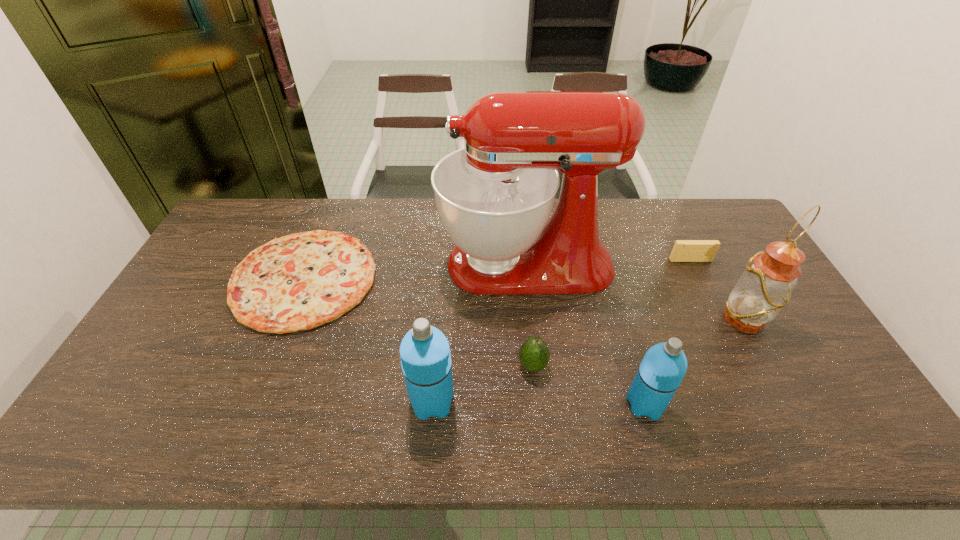
Identify the location of vacant space at the far left corner of the desktop. (240, 221).

In the image, there is a desktop. Where is `vacant area at the far right corner`? vacant area at the far right corner is located at coordinates (713, 201).

Identify the location of free space between the second tallest object and the videotape. The image size is (960, 540). (717, 290).

Where is `vacant space that's between the taller thermos bottle and the videotape`? vacant space that's between the taller thermos bottle and the videotape is located at coordinates (562, 331).

Identify the location of free spot between the pizza and the fifth shortest object. The image size is (960, 540). tap(368, 340).

What are the coordinates of `free space that is in between the left thermos bottle and the second shortest object` in the screenshot? It's located at (562, 331).

Identify the location of free space between the second tallest object and the third tallest object. The height and width of the screenshot is (540, 960). (588, 360).

Identify the location of blank region between the left thermos bottle and the mixer. Image resolution: width=960 pixels, height=540 pixels. (479, 333).

This screenshot has width=960, height=540. Identify the location of free space between the right thermos bottle and the taller thermos bottle. (539, 403).

The height and width of the screenshot is (540, 960). Identify the location of unoccupied position between the fourth shortest object and the shortest object. (474, 342).